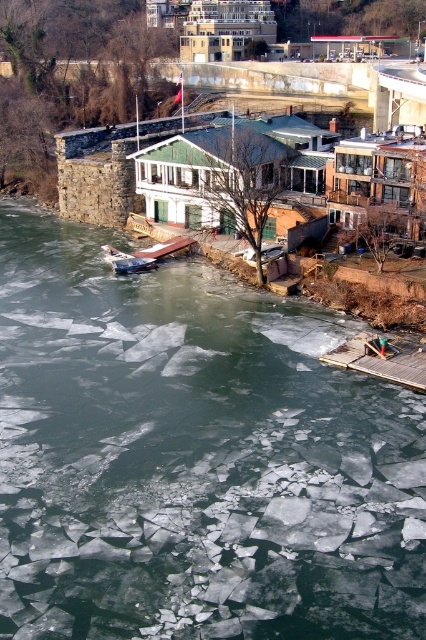
You are standing at the edge of the river and want to place a small decorative rock at the exact location where the translucent ice at lower center is located. According to the coordinates provided, where should you place the rock?

The translucent ice at lower center is located at coordinates point (192,458), so you should place the rock at point (192,458).

You are planning to walk across the translucent ice at lower center and the metallic silver boat at lower left. Which surface is wider according to the description?

The translucent ice at lower center might be wider than the metallic silver boat at lower left according to the description.

You are standing on the riverbank and see the translucent ice at lower center and the metallic silver boat at lower left. Which object is closer to the water surface?

The translucent ice at lower center is below the metallic silver boat at lower left, so the translucent ice at lower center is closer to the water surface.